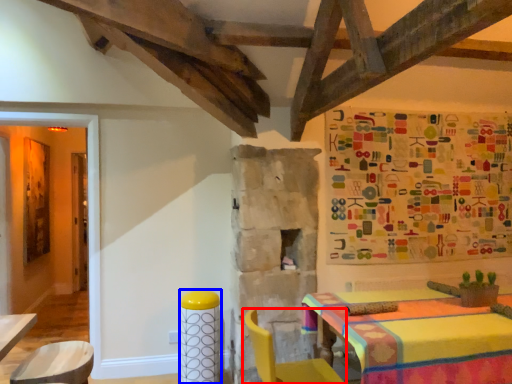
Question: Which object is closer to the camera taking this photo, chair (highlighted by a red box) or bar stool (highlighted by a blue box)?

Choices:
 (A) chair
 (B) bar stool

Answer: (A)